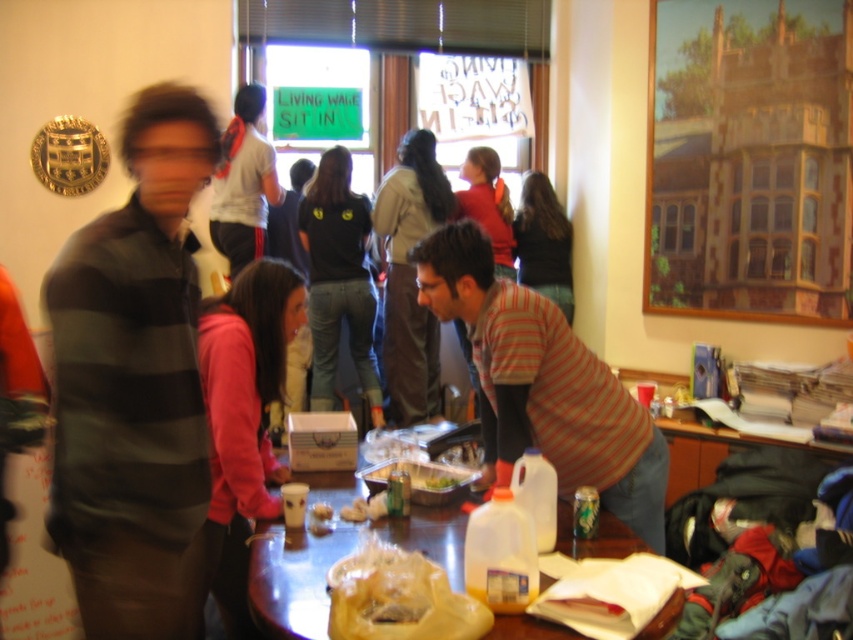
Is translucent plastic bag at center bigger than smooth plastic container at table center?

Yes, translucent plastic bag at center is bigger than smooth plastic container at table center.

Does point (451, 480) come closer to viewer compared to point (312, 506)?

No, (451, 480) is further to viewer.

The width and height of the screenshot is (853, 640). In order to click on translucent plastic bag at center in this screenshot , I will do `click(439, 483)`.

Locate an element on the screen. The height and width of the screenshot is (640, 853). translucent plastic bag at center is located at coordinates pos(439,483).

Does striped cotton shirt at left appear over translucent plastic bag at center?

Correct, striped cotton shirt at left is located above translucent plastic bag at center.

Which of these two, striped cotton shirt at left or translucent plastic bag at center, stands shorter?

With less height is translucent plastic bag at center.

I want to click on striped cotton shirt at left, so click(134, 385).

Is striped cotton shirt at left bigger than smooth plastic container at table center?

Yes, striped cotton shirt at left is bigger than smooth plastic container at table center.

Between point (132, 600) and point (312, 516), which one is positioned behind?

The point (312, 516) is behind.

Does point (136, 237) come farther from viewer compared to point (314, 508)?

No, (136, 237) is in front of (314, 508).

Locate an element on the screen. The image size is (853, 640). striped cotton shirt at left is located at coordinates (134, 385).